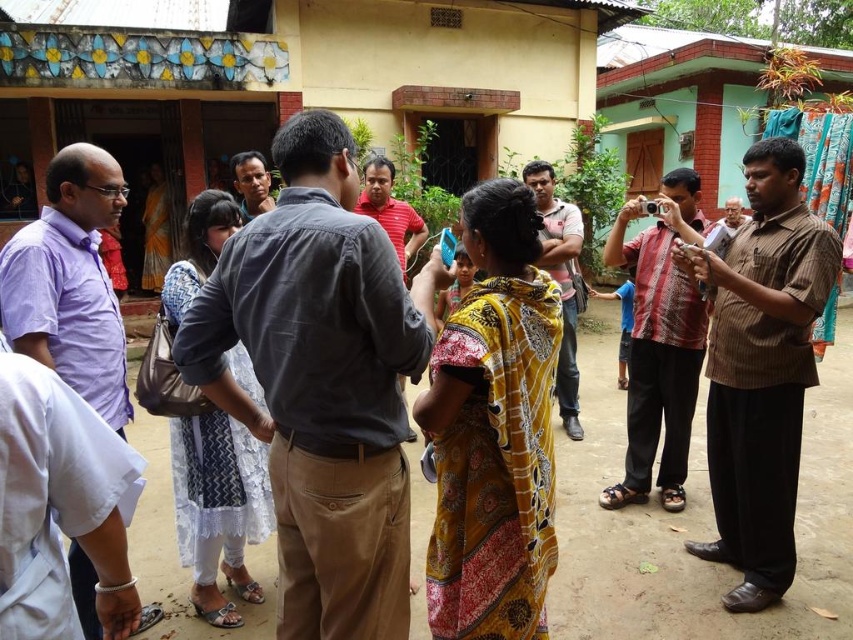
You are a photographer trying to capture a group photo of the people in the scene. You notice the purple cotton shirt at center and the light brown shirt at center. Which shirt should you focus on to ensure the subject in front is properly framed?

The purple cotton shirt at center is in front of the light brown shirt at center, so focusing on the purple cotton shirt at center will ensure the subject in front is properly framed.